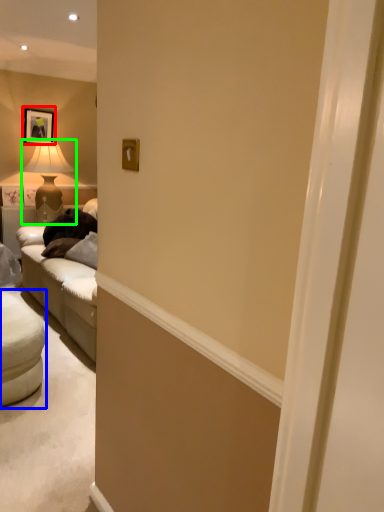
Question: Based on their relative distances, which object is farther from picture frame (highlighted by a red box)? Choose from studio couch (highlighted by a blue box) and table lamp (highlighted by a green box).

Choices:
 (A) studio couch
 (B) table lamp

Answer: (A)